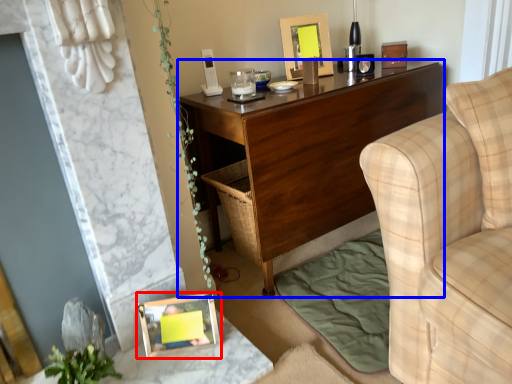
Question: Among these objects, which one is nearest to the camera, picture frame (highlighted by a red box) or desk (highlighted by a blue box)?

Choices:
 (A) picture frame
 (B) desk

Answer: (A)